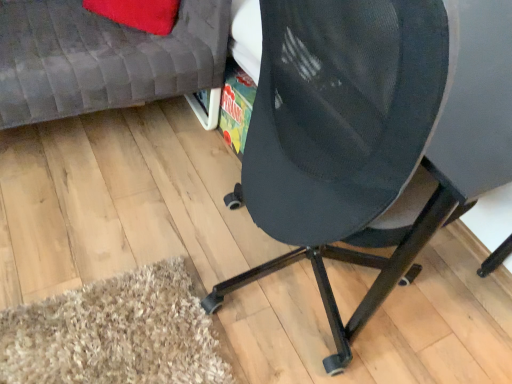
Question: Does black mesh chair at center have a greater height compared to matte gray couch at upper left?

Choices:
 (A) no
 (B) yes

Answer: (B)

Question: Is black mesh chair at center facing towards matte gray couch at upper left?

Choices:
 (A) yes
 (B) no

Answer: (B)

Question: Is black mesh chair at center thinner than matte gray couch at upper left?

Choices:
 (A) no
 (B) yes

Answer: (B)

Question: Is black mesh chair at center located outside matte gray couch at upper left?

Choices:
 (A) no
 (B) yes

Answer: (B)

Question: Is black mesh chair at center placed right next to matte gray couch at upper left?

Choices:
 (A) no
 (B) yes

Answer: (A)

Question: From a real-world perspective, is black mesh chair at center under matte gray couch at upper left?

Choices:
 (A) no
 (B) yes

Answer: (A)

Question: Can you confirm if matte gray couch at upper left is wider than black mesh chair at center?

Choices:
 (A) no
 (B) yes

Answer: (B)

Question: From a real-world perspective, is matte gray couch at upper left physically below black mesh chair at center?

Choices:
 (A) yes
 (B) no

Answer: (A)

Question: Is matte gray couch at upper left outside of black mesh chair at center?

Choices:
 (A) yes
 (B) no

Answer: (A)

Question: From a real-world perspective, is matte gray couch at upper left on black mesh chair at center?

Choices:
 (A) no
 (B) yes

Answer: (A)

Question: Is matte gray couch at upper left positioned behind black mesh chair at center?

Choices:
 (A) yes
 (B) no

Answer: (A)

Question: Is matte gray couch at upper left not close to black mesh chair at center?

Choices:
 (A) no
 (B) yes

Answer: (A)

Question: Do you think matte gray couch at upper left is within black mesh chair at center, or outside of it?

Choices:
 (A) inside
 (B) outside

Answer: (B)